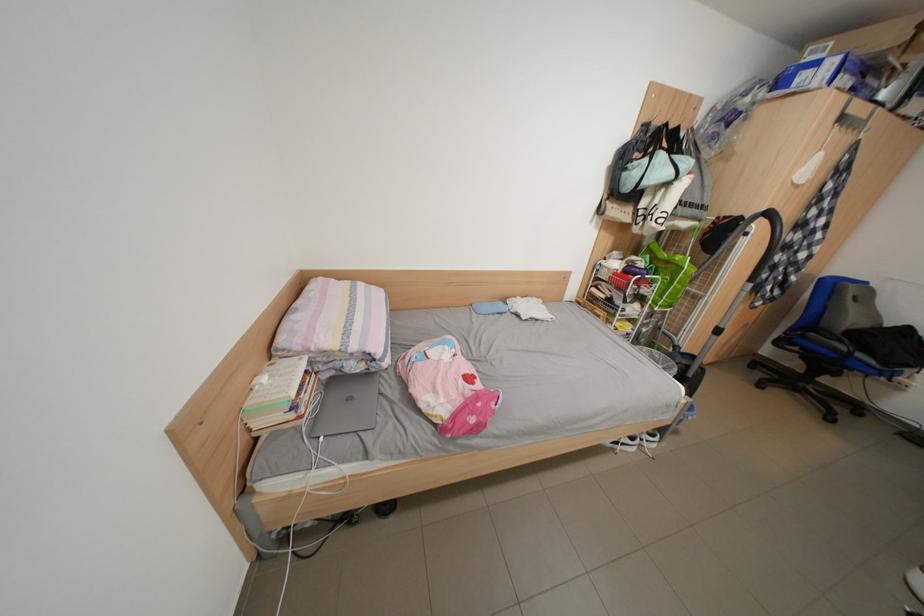
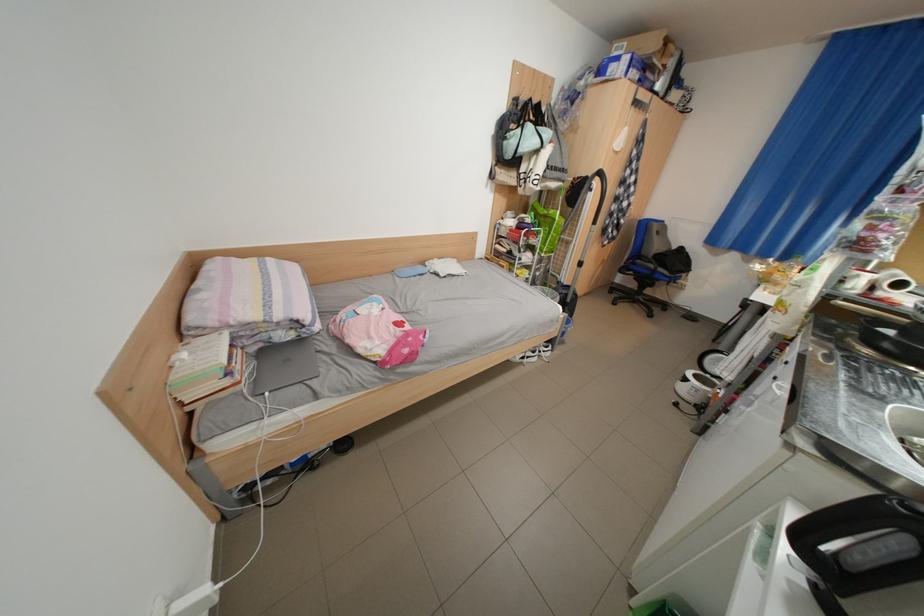
In the second image, find the point that corresponds to point 343,379 in the first image.

(272, 351)